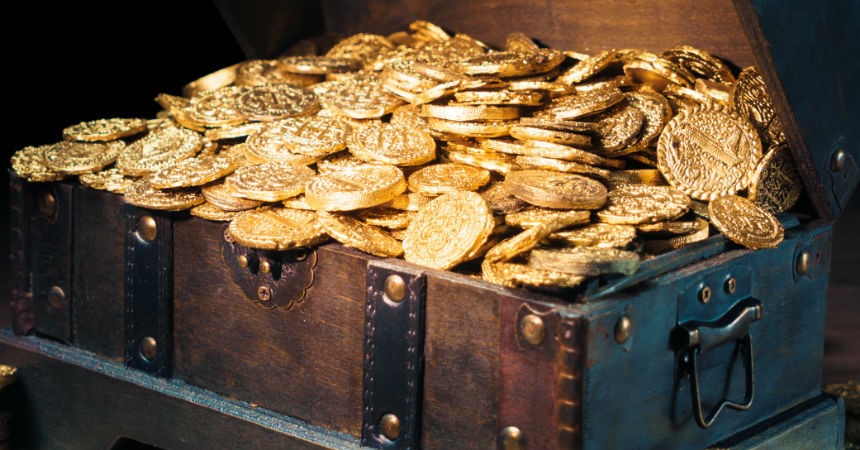
This screenshot has height=450, width=860. Find the location of `brass trunk rivets`. brass trunk rivets is located at coordinates (134, 349), (400, 287), (144, 230), (395, 431), (526, 324), (507, 444), (611, 331), (802, 253), (697, 299), (731, 294).